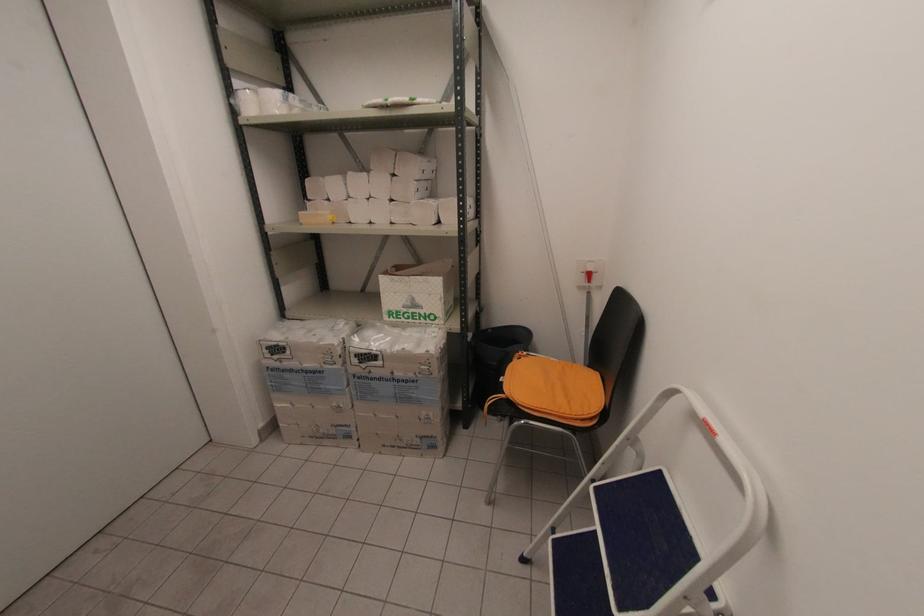
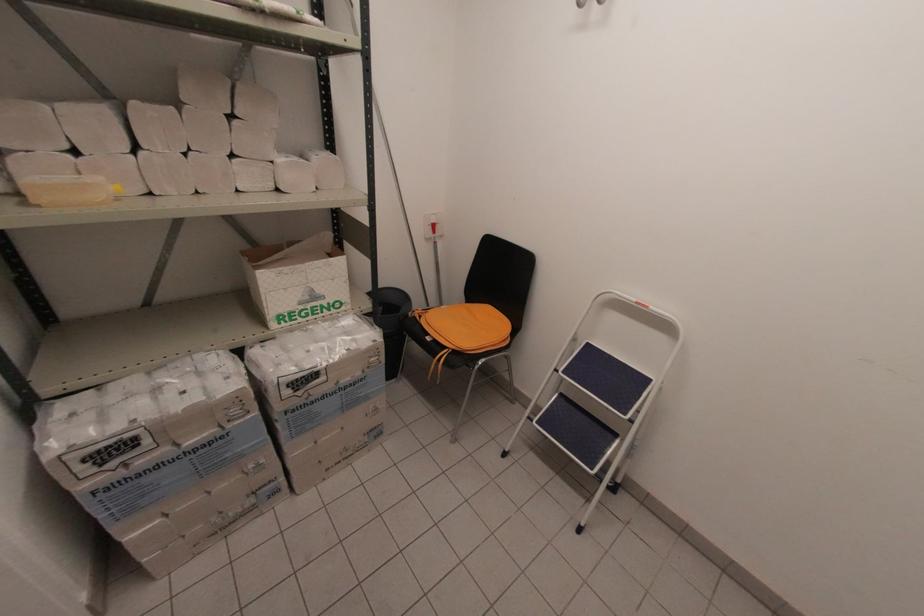
In the second image, find the point that corresponds to point 332,217 in the first image.

(116, 188)